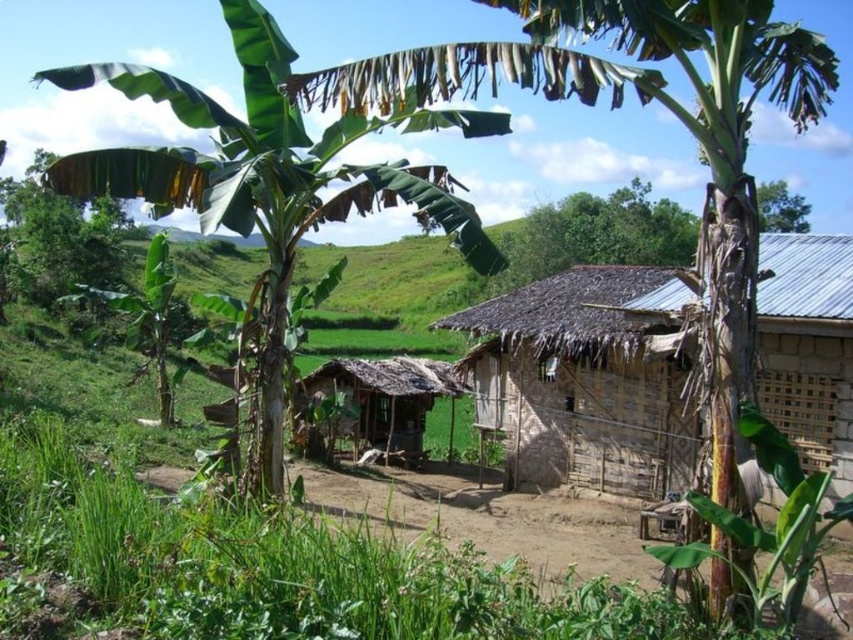
Who is more distant from viewer, (625, 272) or (242, 20)?

Positioned behind is point (625, 272).

Can you confirm if rusty corrugated metal hut at center is positioned above green leafy banana tree at upper left?

No, rusty corrugated metal hut at center is not above green leafy banana tree at upper left.

The image size is (853, 640). Identify the location of rusty corrugated metal hut at center. (585, 380).

Where is `rusty corrugated metal hut at center`? The height and width of the screenshot is (640, 853). rusty corrugated metal hut at center is located at coordinates (585, 380).

Does point (419, 417) come closer to viewer compared to point (782, 198)?

Yes, it is in front of point (782, 198).

Can you confirm if brown thatch hut at center is thinner than green leafy tree at upper center?

Yes, brown thatch hut at center is thinner than green leafy tree at upper center.

Is point (299, 388) positioned after point (763, 216)?

No, it is in front of (763, 216).

Where is `brown thatch hut at center`? The height and width of the screenshot is (640, 853). brown thatch hut at center is located at coordinates pyautogui.click(x=384, y=397).

Between point (531, 355) and point (18, 188), which one is positioned in front?

Point (531, 355)

Is point (643, 285) closer to camera compared to point (3, 285)?

Yes.

Describe the element at coordinates (585, 380) in the screenshot. I see `rusty corrugated metal hut at center` at that location.

At what (x,y) coordinates should I click in order to perform the action: click on rusty corrugated metal hut at center. Please return your answer as a coordinate pair (x, y). This screenshot has height=640, width=853. Looking at the image, I should click on (585, 380).